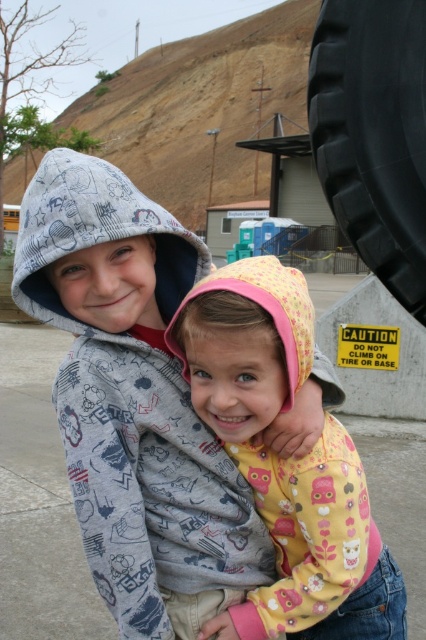
Does gray cotton hoodie at center have a smaller size compared to black rubber tire at upper right?

No, gray cotton hoodie at center is not smaller than black rubber tire at upper right.

The height and width of the screenshot is (640, 426). Describe the element at coordinates (134, 401) in the screenshot. I see `gray cotton hoodie at center` at that location.

The image size is (426, 640). What are the coordinates of `gray cotton hoodie at center` in the screenshot? It's located at (134, 401).

Is gray cotton hoodie at center taller than yellow fabric hoodie at center?

Correct, gray cotton hoodie at center is much taller as yellow fabric hoodie at center.

Between point (83, 433) and point (339, 538), which one is positioned behind?

The point (339, 538) is more distant.

Image resolution: width=426 pixels, height=640 pixels. Find the location of `gray cotton hoodie at center`. gray cotton hoodie at center is located at coordinates (134, 401).

Does yellow fabric hoodie at center have a lesser width compared to black rubber tire at upper right?

In fact, yellow fabric hoodie at center might be wider than black rubber tire at upper right.

Does yellow fabric hoodie at center appear over black rubber tire at upper right?

No.

Image resolution: width=426 pixels, height=640 pixels. I want to click on yellow fabric hoodie at center, so click(284, 460).